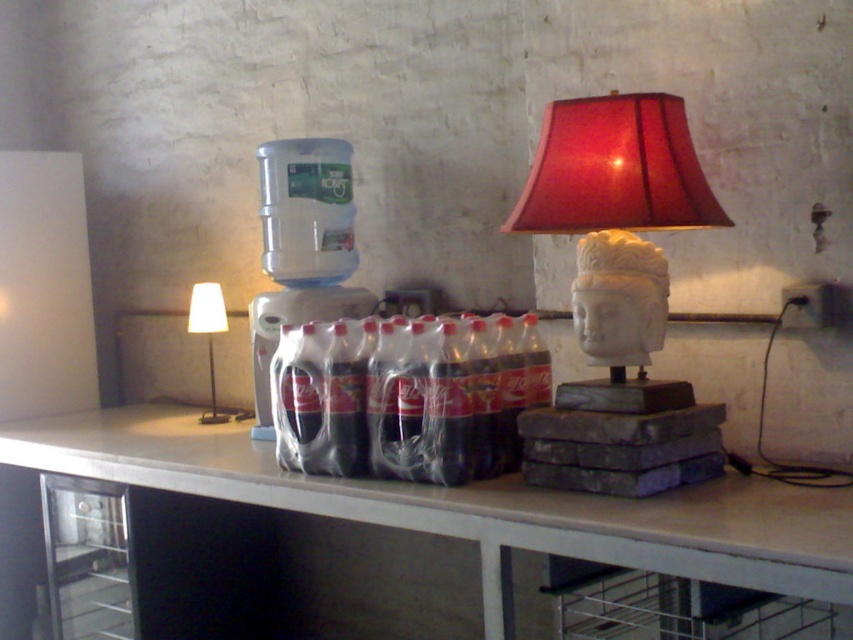
Question: Is matte white head at upper right closer to camera compared to white fabric lampshade at left?

Choices:
 (A) no
 (B) yes

Answer: (B)

Question: Which object appears farthest from the camera in this image?

Choices:
 (A) matte white head at upper right
 (B) white concrete table at center

Answer: (A)

Question: Among these objects, which one is nearest to the camera?

Choices:
 (A) white fabric lampshade at left
 (B) white concrete table at center
 (C) matte white head at upper right

Answer: (B)

Question: Which object appears closest to the camera in this image?

Choices:
 (A) white fabric lampshade at left
 (B) white concrete table at center

Answer: (B)

Question: Can you confirm if white concrete table at center is wider than matte white head at upper right?

Choices:
 (A) no
 (B) yes

Answer: (B)

Question: In this image, where is white concrete table at center located relative to white fabric lampshade at left?

Choices:
 (A) right
 (B) left

Answer: (A)